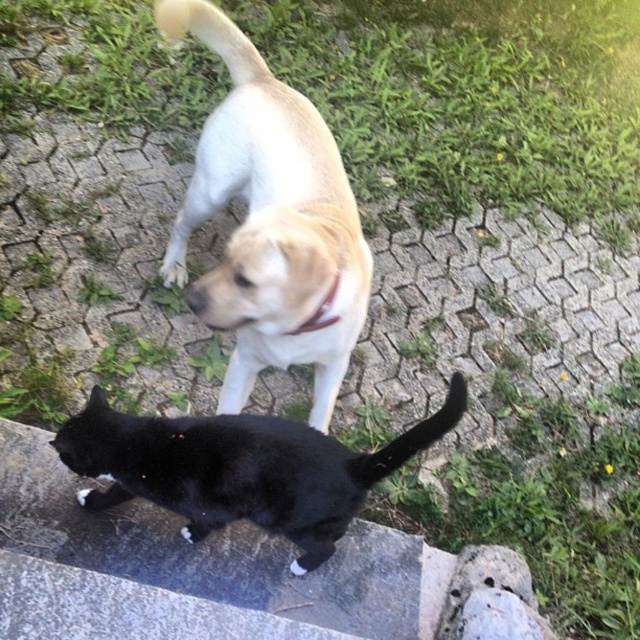
Question: Which object is closer to the camera taking this photo?

Choices:
 (A) black matte tail at lower center
 (B) light brown fur dog at center
 (C) black matte fur cat at lower left

Answer: (B)

Question: Which point is farther from the camera taking this photo?

Choices:
 (A) (177, 225)
 (B) (369, 468)

Answer: (A)

Question: Can you confirm if black matte fur cat at lower left is wider than black matte tail at lower center?

Choices:
 (A) no
 (B) yes

Answer: (B)

Question: Is light brown fur dog at center to the left of black matte tail at lower center from the viewer's perspective?

Choices:
 (A) no
 (B) yes

Answer: (B)

Question: Can you confirm if light brown fur dog at center is bigger than black matte fur cat at lower left?

Choices:
 (A) yes
 (B) no

Answer: (A)

Question: Among these objects, which one is farthest from the camera?

Choices:
 (A) black matte fur cat at lower left
 (B) light brown fur dog at center

Answer: (A)